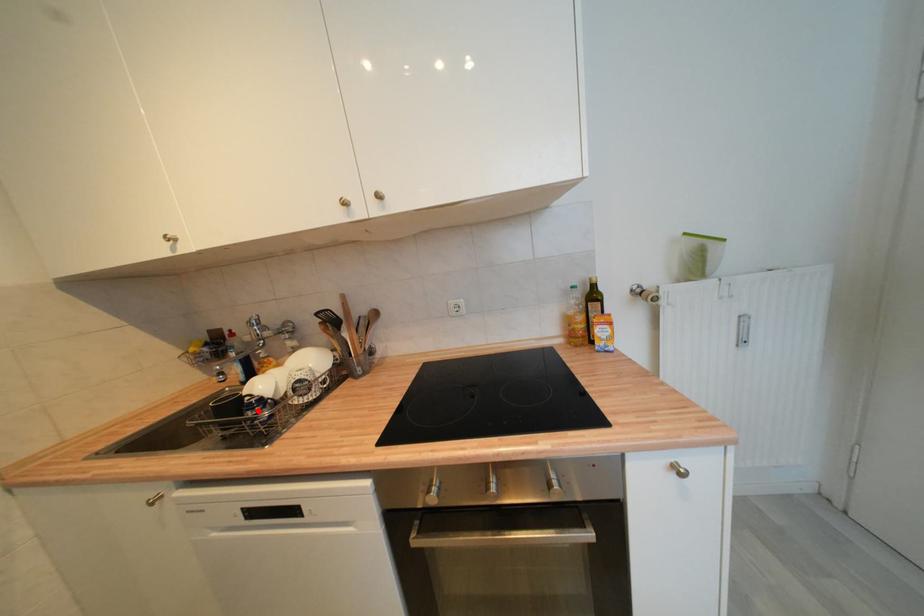
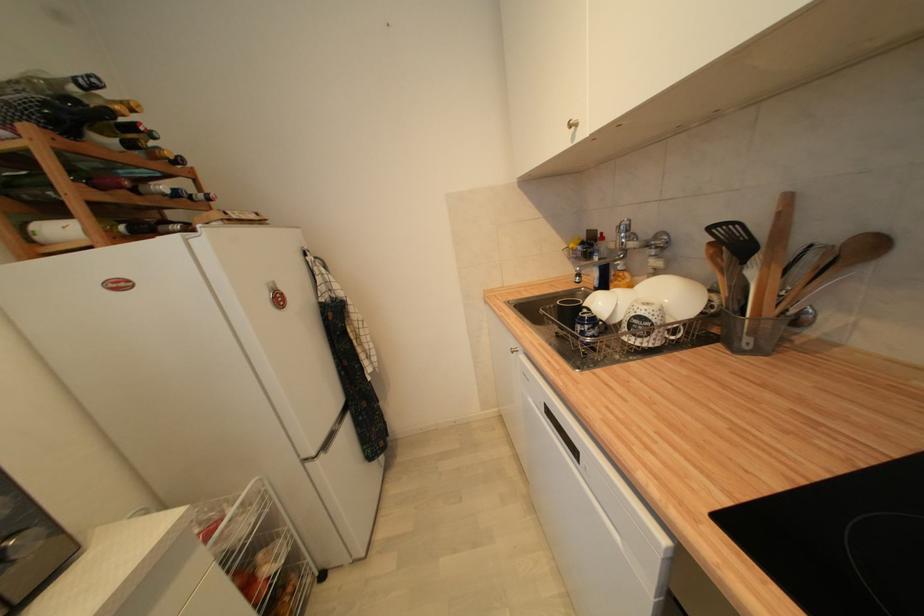
The point at the highlighted location is marked in the first image. Where is the corresponding point in the second image?

(588, 326)